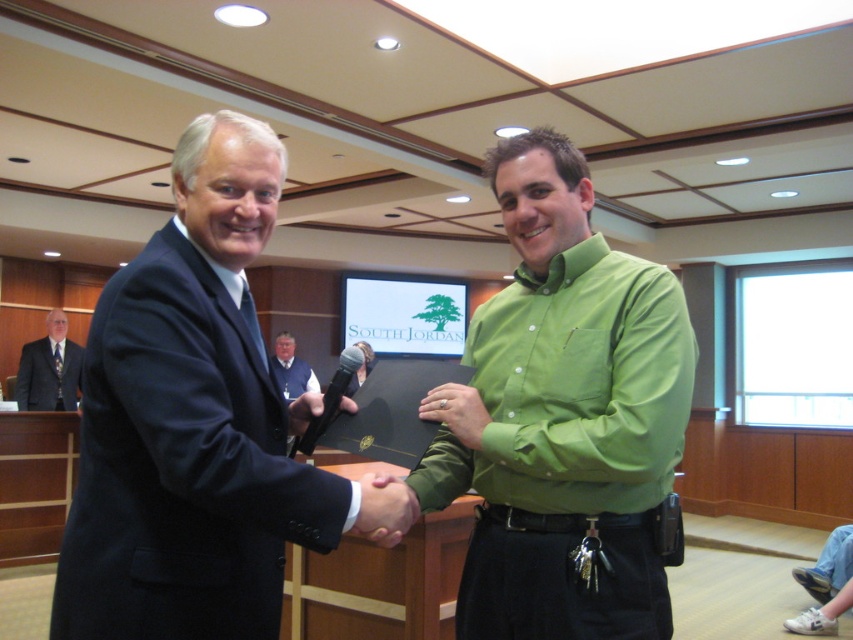
You are an event photographer at the SOUTH JORDAN event. You notice the green matte hand at center and the green matte shirt at center. Based on their positions, which object is closer to the camera?

The green matte hand at center is behind the green matte shirt at center, so the green matte shirt at center is closer to the camera.

You are an event organizer standing in front of the wooden paneled wall. You need to retrieve the vest at center and the matte black folder at center from their current positions. Which object should you reach for first if you want to pick up the one that is lower?

The vest at center is positioned under the matte black folder at center, so you should reach for the vest at center first since it is lower.